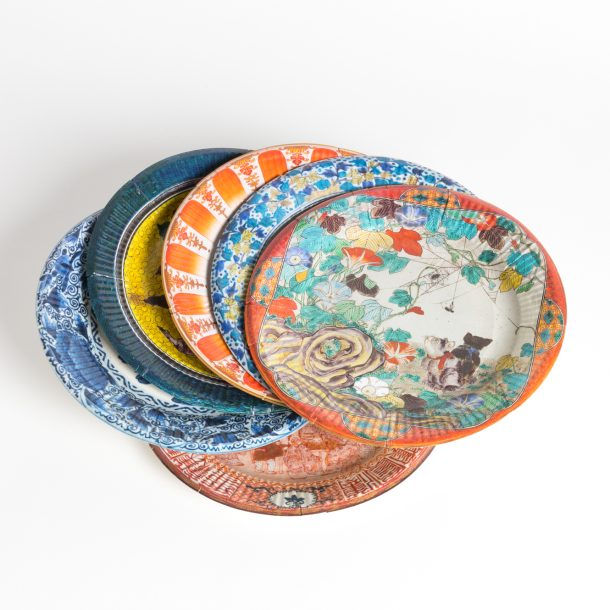
The width and height of the screenshot is (610, 610). I want to click on plate, so click(356, 296), click(257, 223), click(199, 214), click(149, 227), click(79, 324), click(293, 479).